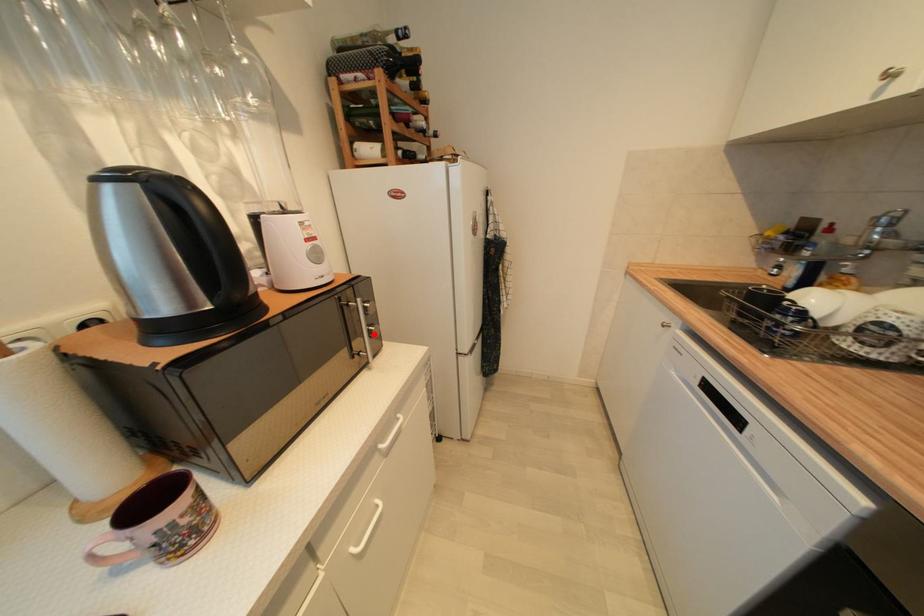
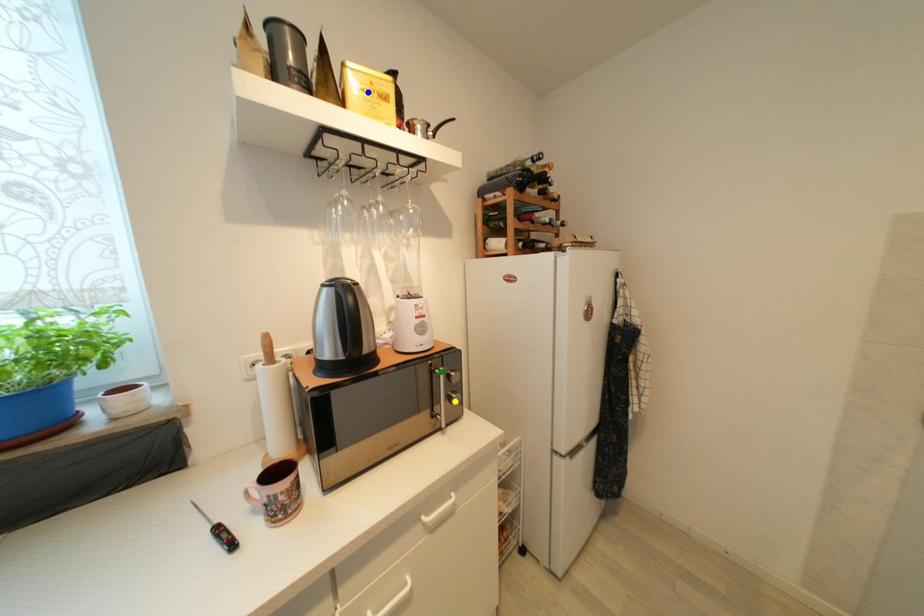
Question: I am providing you with two images of the same scene from different viewpoints. A red point is marked on the first image. You are given multiple points on the second image. In image 2, which mark is for the same physical point as the one in image 1?

Choices:
 (A) blue point
 (B) yellow point
 (C) green point

Answer: (B)